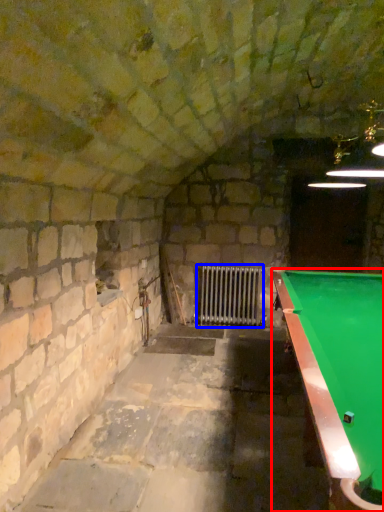
Question: Which point is further to the camera, billiard table (highlighted by a red box) or radiator (highlighted by a blue box)?

Choices:
 (A) billiard table
 (B) radiator

Answer: (B)